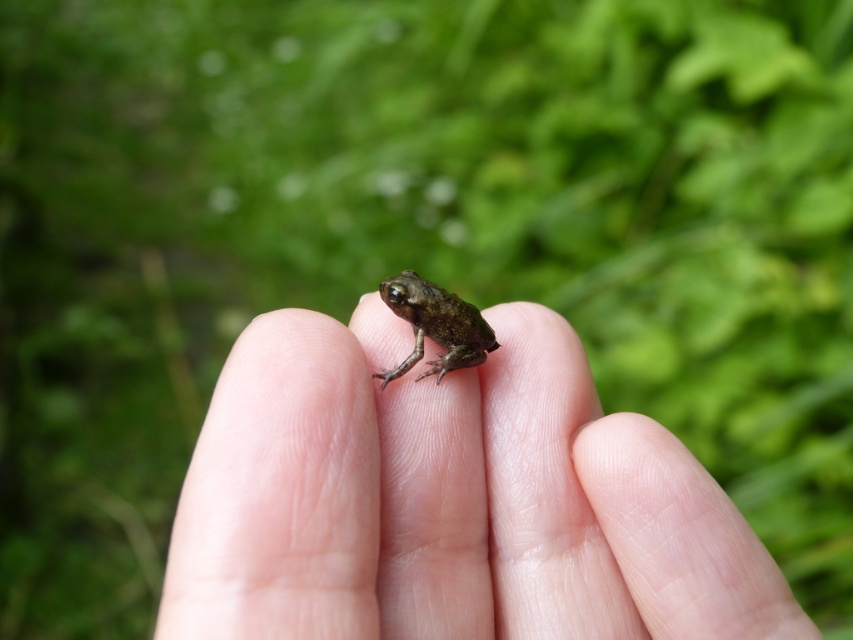
Based on the photo, can you confirm if smooth skin palm at center is positioned to the left of green matte frog at center?

In fact, smooth skin palm at center is to the right of green matte frog at center.

Does smooth skin palm at center appear under green matte frog at center?

Indeed, smooth skin palm at center is positioned under green matte frog at center.

In order to click on smooth skin palm at center in this screenshot , I will do `click(450, 499)`.